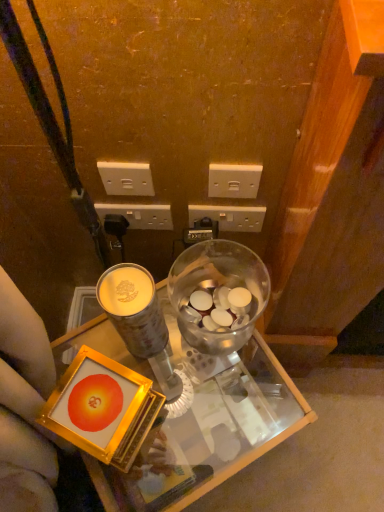
Where is `free spot in front of translucent glass jar at center`? The height and width of the screenshot is (512, 384). free spot in front of translucent glass jar at center is located at coordinates (220, 414).